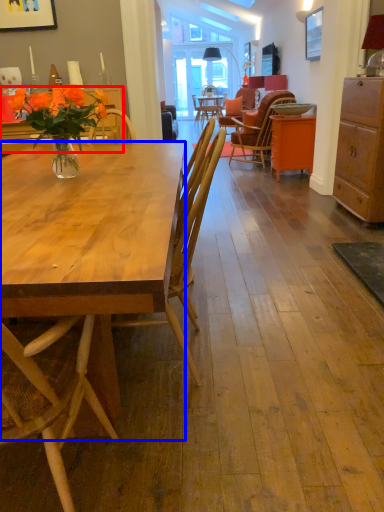
Question: Which object appears closest to the camera in this image, desk (highlighted by a red box) or desk (highlighted by a blue box)?

Choices:
 (A) desk
 (B) desk

Answer: (B)